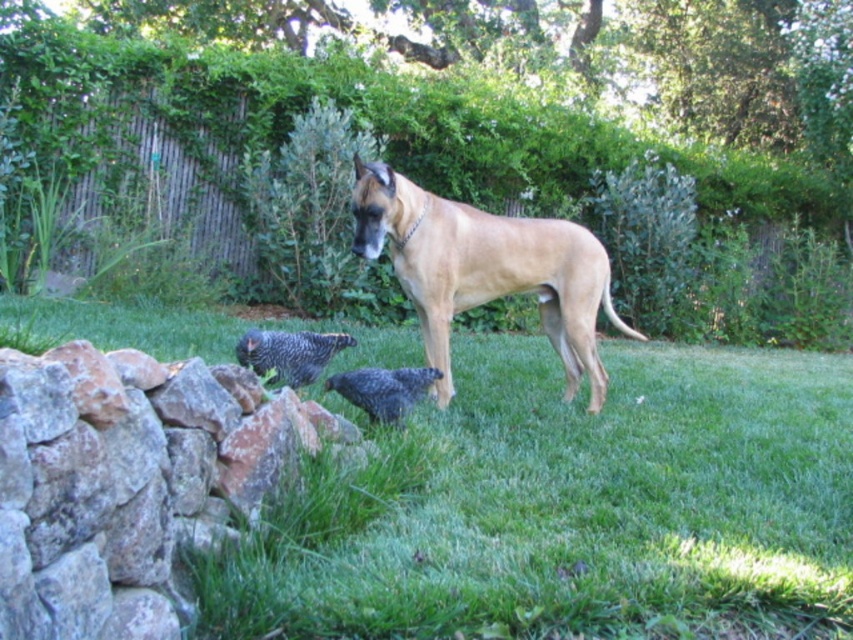
Is point (349, 348) closer to viewer compared to point (53, 413)?

No, (349, 348) is further to viewer.

The width and height of the screenshot is (853, 640). I want to click on green grass at lower center, so click(569, 506).

The height and width of the screenshot is (640, 853). Identify the location of green grass at lower center. (569, 506).

Who is more distant from viewer, (244, 474) or (480, 236)?

The point (480, 236) is more distant.

You are a GUI agent. You are given a task and a screenshot of the screen. Output one action in this format:
    pyautogui.click(x=<x>, y=<y>)
    Task: Click on the rustic stone wall at lower left
    Image resolution: width=853 pixels, height=640 pixels.
    Given the screenshot: What is the action you would take?
    pyautogui.click(x=129, y=481)

Where is `rustic stone wall at lower left`? rustic stone wall at lower left is located at coordinates (129, 481).

Is the position of green grass at lower center less distant than that of golden tan fur at center?

Yes, green grass at lower center is closer to the viewer.

Identify the location of green grass at lower center. This screenshot has width=853, height=640. (569, 506).

Does point (363, 413) come farther from viewer compared to point (381, 243)?

That is False.

Find the location of `green grass at lower center`. green grass at lower center is located at coordinates (569, 506).